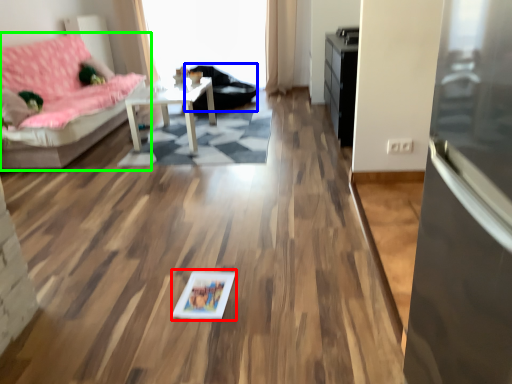
Question: Which object is positioned closest to picture frame (highlighted by a red box)? Select from armchair (highlighted by a blue box) and studio couch (highlighted by a green box).

Choices:
 (A) armchair
 (B) studio couch

Answer: (B)